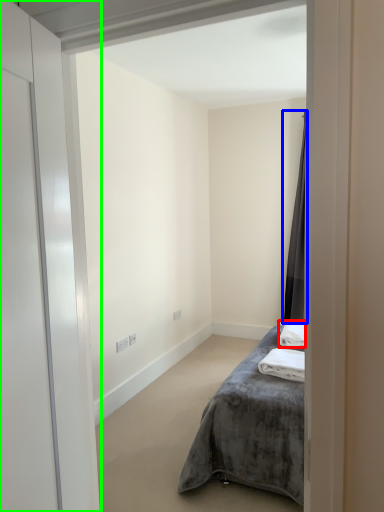
Question: Which object is positioned farthest from bath towel (highlighted by a red box)? Select from curtain (highlighted by a blue box) and door (highlighted by a green box).

Choices:
 (A) curtain
 (B) door

Answer: (B)